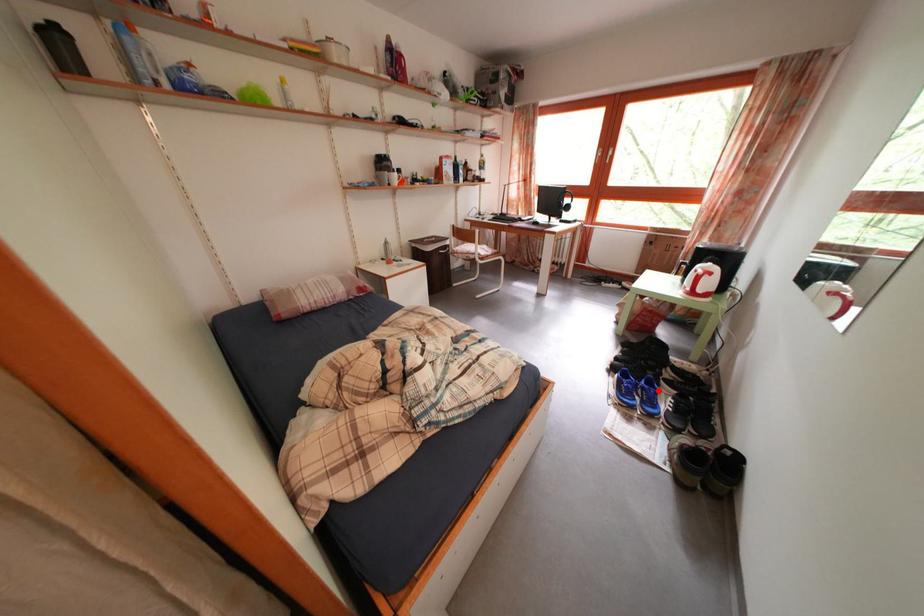
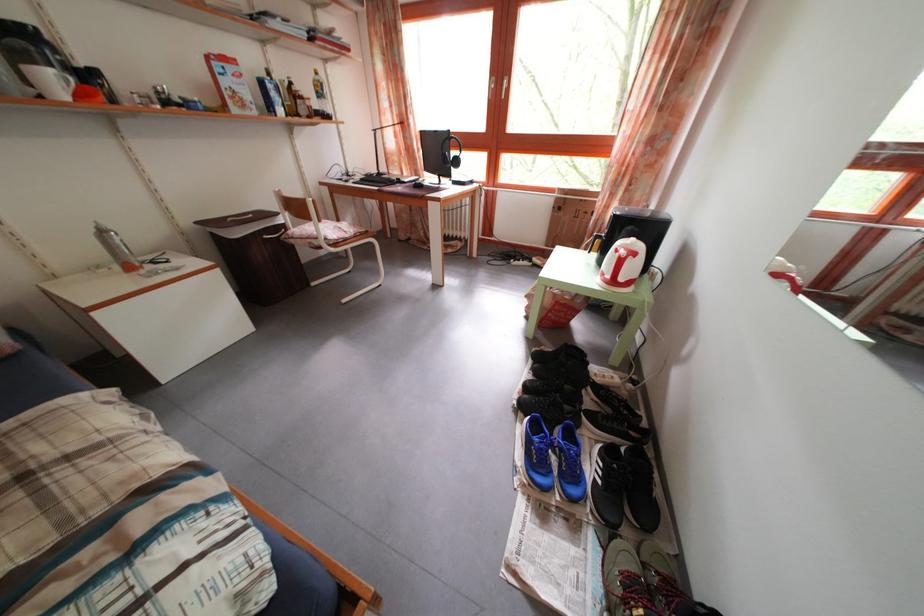
Question: I am providing you with two images of the same scene from different viewpoints. A red point is shown in image1. For the corresponding object point in image2, is it positioned nearer or farther from the camera?

Choices:
 (A) Nearer
 (B) Farther

Answer: (A)